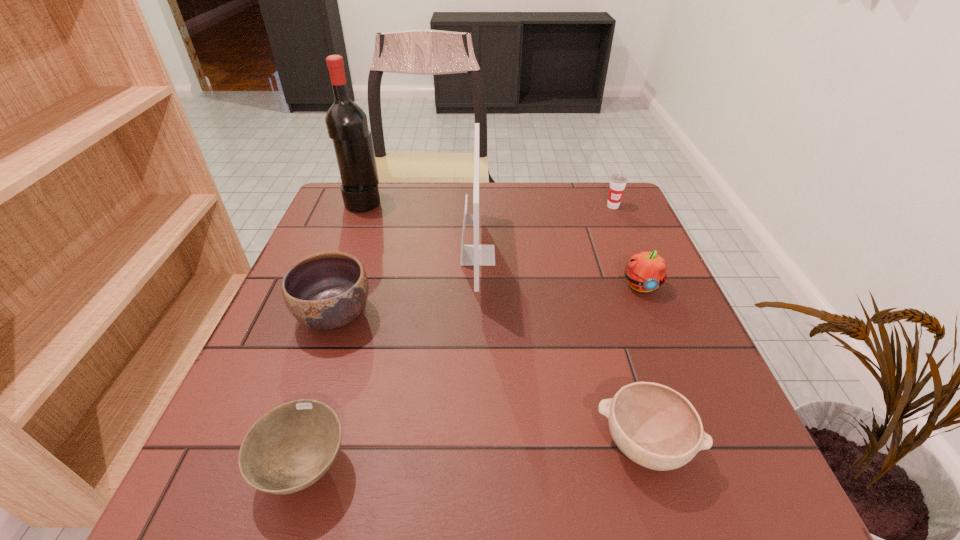
Identify the location of blank area located on the front of the tallest bowl. (286, 456).

Image resolution: width=960 pixels, height=540 pixels. Identify the location of vacant space located 0.210m on the front of the apple. (677, 378).

Identify the location of vacant space positioned on the left of the rightmost bowl. Image resolution: width=960 pixels, height=540 pixels. (484, 444).

Identify the location of wine bottle that is at the far edge. (346, 122).

Locate an element on the screen. The image size is (960, 540). monitor at the far edge is located at coordinates (476, 255).

This screenshot has width=960, height=540. What are the coordinates of `cup that is at the far edge` in the screenshot? It's located at (618, 182).

Locate an element on the screen. This screenshot has width=960, height=540. wine bottle located at the left edge is located at coordinates (346, 122).

At what (x,y) coordinates should I click in order to perform the action: click on cup that is at the right edge. Please return your answer as a coordinate pair (x, y). Looking at the image, I should click on (618, 182).

Identify the location of apple that is at the right edge. The height and width of the screenshot is (540, 960). (645, 271).

At what (x,y) coordinates should I click in order to perform the action: click on bowl located in the right edge section of the desktop. Please return your answer as a coordinate pair (x, y). The width and height of the screenshot is (960, 540). Looking at the image, I should click on (655, 426).